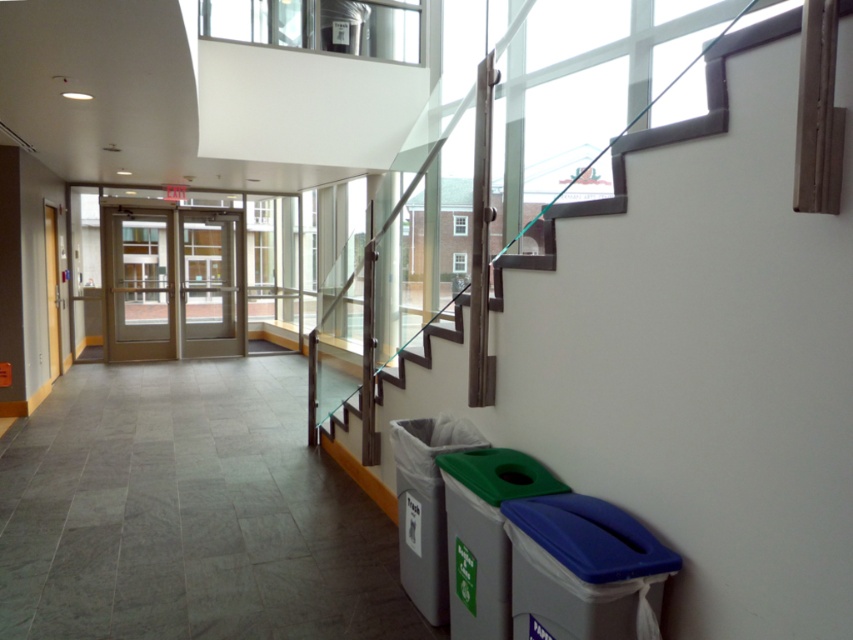
Question: Which of these objects is positioned closest to the green plastic recycling bin at lower right?

Choices:
 (A) blue plastic recycling bin at lower right
 (B) gray plastic recycling bin at lower right

Answer: (A)

Question: Which point appears closest to the camera in this image?

Choices:
 (A) (527, 545)
 (B) (450, 483)

Answer: (A)

Question: Which point is farther to the camera?

Choices:
 (A) blue plastic recycling bin at lower right
 (B) green plastic recycling bin at lower right

Answer: (B)

Question: Where is blue plastic recycling bin at lower right located in relation to gray plastic recycling bin at lower right in the image?

Choices:
 (A) right
 (B) left

Answer: (A)

Question: Is blue plastic recycling bin at lower right above green plastic recycling bin at lower right?

Choices:
 (A) no
 (B) yes

Answer: (B)

Question: Can you confirm if blue plastic recycling bin at lower right is thinner than gray plastic recycling bin at lower right?

Choices:
 (A) yes
 (B) no

Answer: (B)